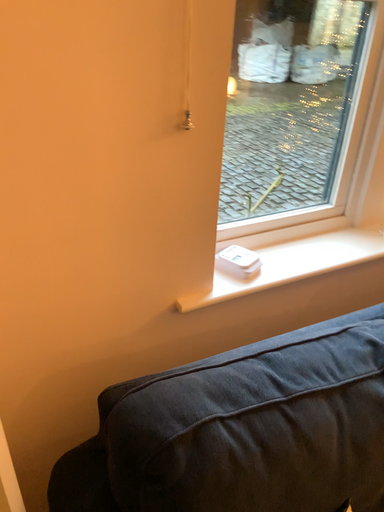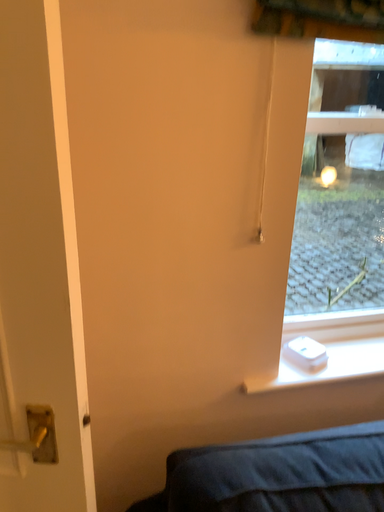
Question: How did the camera likely rotate when shooting the video?

Choices:
 (A) rotated downward
 (B) rotated upward

Answer: (B)